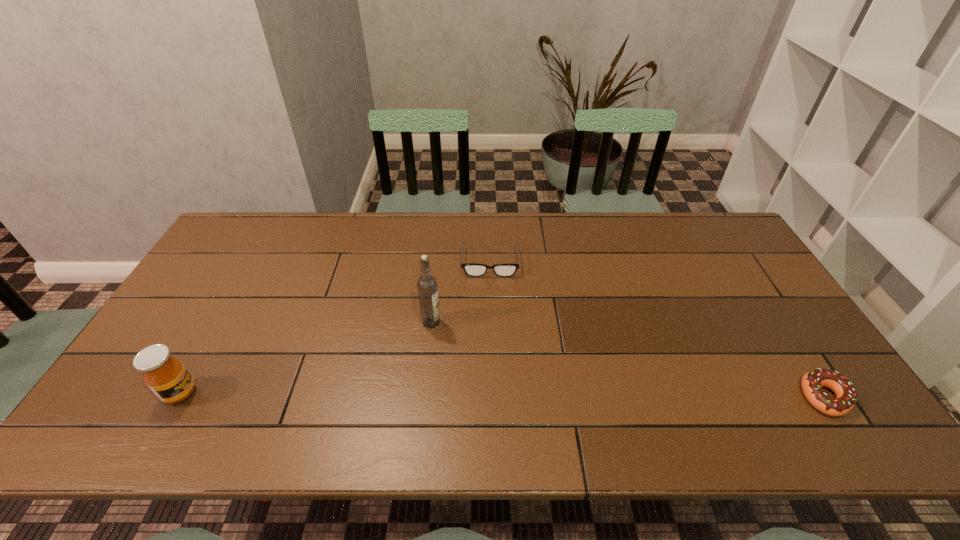
You are a GUI agent. You are given a task and a screenshot of the screen. Output one action in this format:
    pyautogui.click(x=<x>, y=<y>)
    Task: Click on the vacant spot on the desktop that is between the second tallest object and the rightmost object and is positioned on the label of the tallest object
    This screenshot has height=540, width=960.
    Given the screenshot: What is the action you would take?
    pyautogui.click(x=516, y=395)

You are a GUI agent. You are given a task and a screenshot of the screen. Output one action in this format:
    pyautogui.click(x=<x>, y=<y>)
    Task: Click on the free space on the desktop that is between the third shortest object and the doughnut and is positioned on the front-facing side of the second object from right to left
    
    Given the screenshot: What is the action you would take?
    pyautogui.click(x=491, y=395)